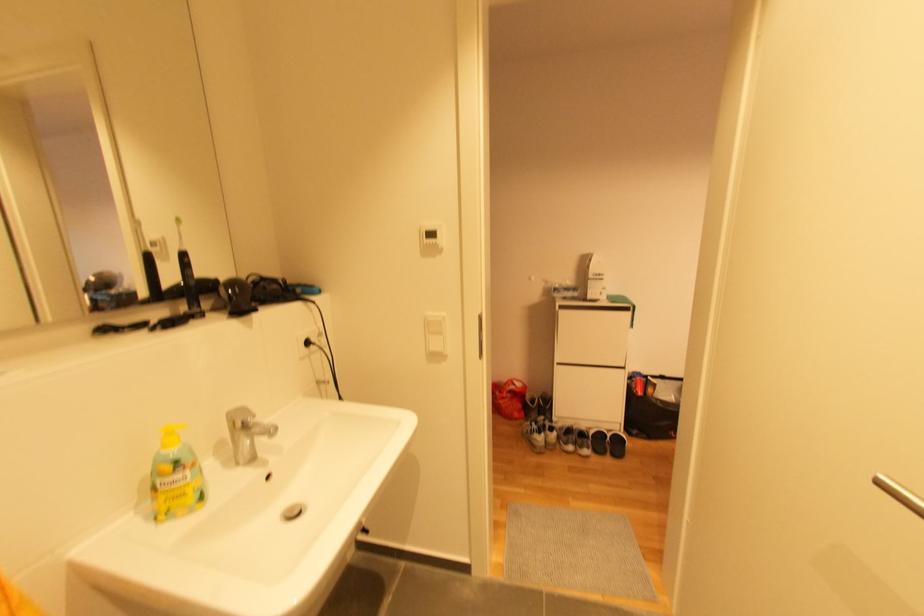
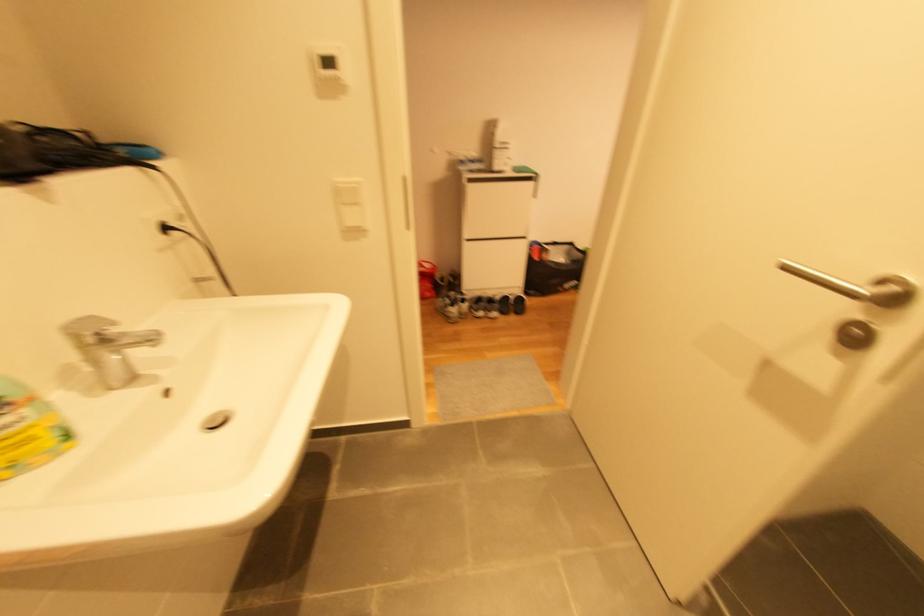
In a continuous first-person perspective shot, in which direction is the camera moving?

The movement direction of the cameraman is left, forward.